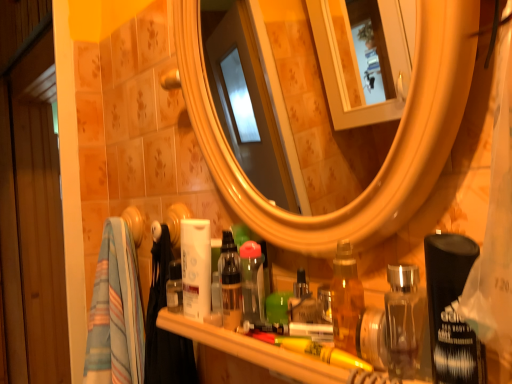
Question: Looking at their shapes, would you say green plastic brush at center, which is the 1th toiletry in right-to-left order, is wider or thinner than clear plastic bottle at center, the 2th toiletry when ordered from right to left?

Choices:
 (A) wide
 (B) thin

Answer: (A)

Question: Is green plastic brush at center, which is the 1th toiletry in right-to-left order, situated inside clear plastic bottle at center, which appears as the 2th toiletry when viewed from the left, or outside?

Choices:
 (A) outside
 (B) inside

Answer: (A)

Question: Which of these objects is positioned closest to the translucent plastic bottle at center, which appears as the third toiletry when viewed from the right?

Choices:
 (A) clear plastic bottle at center, the 2th toiletry when ordered from right to left
 (B) green plastic brush at center, which is the 1th toiletry in right-to-left order
 (C) translucent plastic items at lower center

Answer: (A)

Question: Which object is positioned closest to the translucent plastic bottle at center, which appears as the third toiletry when viewed from the right?

Choices:
 (A) clear plastic bottle at center, which appears as the 2th toiletry when viewed from the left
 (B) translucent plastic items at lower center
 (C) green plastic brush at center, which is the 1th toiletry in right-to-left order

Answer: (A)